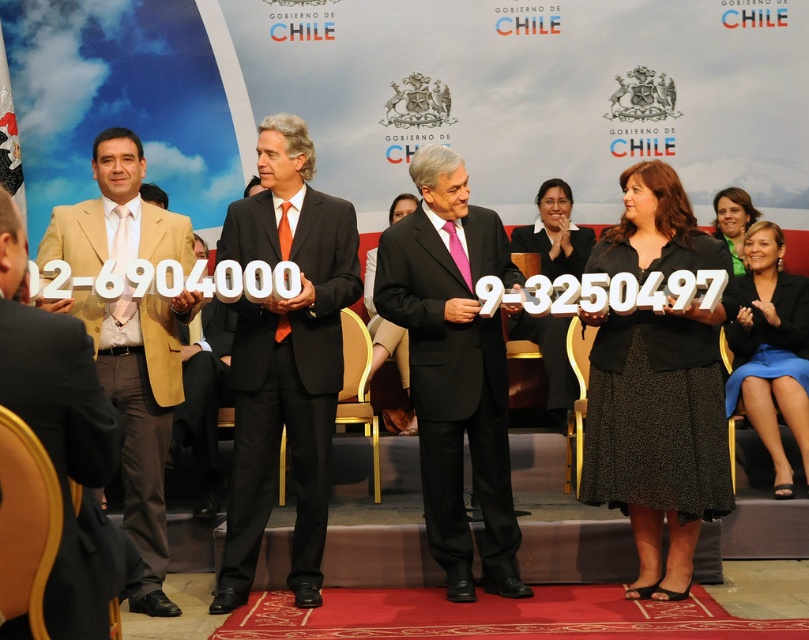
Question: Does black matte suit at center have a greater width compared to black dress at center?

Choices:
 (A) no
 (B) yes

Answer: (A)

Question: Which object is closer to the camera taking this photo?

Choices:
 (A) gold metallic chair at center
 (B) matte black suit at center

Answer: (B)

Question: Based on their relative distances, which object is nearer to the black matte suit at left?

Choices:
 (A) black fabric dress at center
 (B) blue fabric skirt at lower right

Answer: (A)

Question: Which point appears closest to the camera in this image?

Choices:
 (A) (570, 404)
 (B) (130, 566)

Answer: (B)

Question: Is matte black suit at center above beige fabric suit at left?

Choices:
 (A) no
 (B) yes

Answer: (B)

Question: Can you confirm if black matte suit at left is positioned to the right of blue fabric skirt at lower right?

Choices:
 (A) yes
 (B) no

Answer: (B)